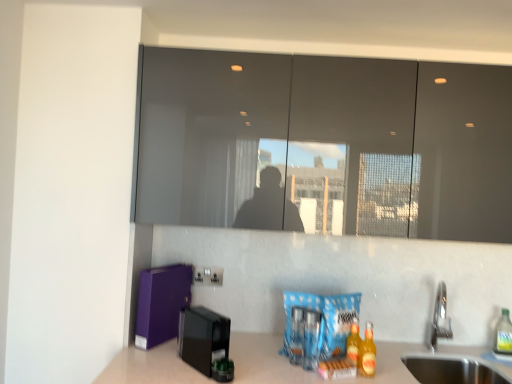
What do you see at coordinates (203, 337) in the screenshot?
I see `black plastic coffee machine at lower left` at bounding box center [203, 337].

This screenshot has width=512, height=384. In order to click on stainless steel sink at lower right, which ranks as the 2th sink in top-to-bottom order in this screenshot , I will do `click(452, 370)`.

Describe the element at coordinates (452, 370) in the screenshot. This screenshot has height=384, width=512. I see `silver metallic sink at lower right, the 1th sink from the top` at that location.

Identify the location of clear plastic bottle at lower right, the third beverage in the left-to-right sequence. (503, 335).

Looking at their sizes, would you say clear plastic bottle at lower right, placed as the 1th beverage when sorted from right to left, is wider or thinner than matte gray mirror at upper center?

Considering their sizes, clear plastic bottle at lower right, placed as the 1th beverage when sorted from right to left, looks slimmer than matte gray mirror at upper center.

Considering the sizes of objects clear plastic bottle at lower right, which is the third beverage from front to back, and matte gray mirror at upper center in the image provided, who is taller, clear plastic bottle at lower right, which is the third beverage from front to back, or matte gray mirror at upper center?

Standing taller between the two is matte gray mirror at upper center.

From a real-world perspective, is clear plastic bottle at lower right, which is counted as the first beverage, starting from the back, above or below matte gray mirror at upper center?

clear plastic bottle at lower right, which is counted as the first beverage, starting from the back, is situated lower than matte gray mirror at upper center in the real world.

Is clear plastic bottle at lower right, which is counted as the first beverage, starting from the back, facing towards matte gray mirror at upper center?

No, clear plastic bottle at lower right, which is counted as the first beverage, starting from the back, is not aimed at matte gray mirror at upper center.

What are the coordinates of `sink below the black plastic coffee machine at lower left (from a real-world perspective)` in the screenshot? It's located at (452, 370).

Is stainless steel sink at lower right, which is the first sink from bottom to top, at the right side of black plastic coffee machine at lower left?

Yes.

Does stainless steel sink at lower right, which is the first sink from bottom to top, have a greater height compared to black plastic coffee machine at lower left?

No, stainless steel sink at lower right, which is the first sink from bottom to top, is not taller than black plastic coffee machine at lower left.

Can you confirm if silver metallic sink at lower right, the 1th sink from the top, is wider than black plastic coffee machine at lower left?

In fact, silver metallic sink at lower right, the 1th sink from the top, might be narrower than black plastic coffee machine at lower left.

How many degrees apart are the facing directions of silver metallic sink at lower right, the 1th sink from the top, and black plastic coffee machine at lower left?

The angular difference between silver metallic sink at lower right, the 1th sink from the top, and black plastic coffee machine at lower left is 41.1 degrees.

Consider the image. Choose the correct answer: Is silver metallic sink at lower right, acting as the second sink starting from the bottom, inside black plastic coffee machine at lower left or outside it?

silver metallic sink at lower right, acting as the second sink starting from the bottom, cannot be found inside black plastic coffee machine at lower left.

Which of these two, translucent glass bottles at lower right, placed as the second beverage when sorted from right to left, or matte gray mirror at upper center, stands taller?

matte gray mirror at upper center.

This screenshot has width=512, height=384. What are the coordinates of `mirror positioned vertically above the translucent glass bottles at lower right, which is counted as the third beverage, starting from the back (from a real-world perspective)` in the screenshot? It's located at (325, 145).

Considering their positions, is translucent glass bottles at lower right, which is the second beverage from left to right, located in front of or behind matte gray mirror at upper center?

Clearly, translucent glass bottles at lower right, which is the second beverage from left to right, is in front of matte gray mirror at upper center.

Is translucent glass bottles at lower right, placed as the second beverage when sorted from right to left, positioned beyond the bounds of matte gray mirror at upper center?

Indeed, translucent glass bottles at lower right, placed as the second beverage when sorted from right to left, is completely outside matte gray mirror at upper center.

Is translucent glass bottles at lower right, which is the second beverage from left to right, inside translucent plastic bottle at center, the 3th beverage positioned from the right?

No, translucent glass bottles at lower right, which is the second beverage from left to right, is located outside of translucent plastic bottle at center, the 3th beverage positioned from the right.

From a real-world perspective, who is located higher, translucent plastic bottle at center, the 3th beverage positioned from the right, or translucent glass bottles at lower right, which is counted as the third beverage, starting from the back?

In real-world perspective, translucent glass bottles at lower right, which is counted as the third beverage, starting from the back, is above.

This screenshot has height=384, width=512. Identify the location of the 1st beverage behind the translucent glass bottles at lower right, which is counted as the third beverage, starting from the back, counting from the anchor's position. (353, 341).

In terms of width, does translucent plastic bottle at center, which is counted as the 2th beverage, starting from the front, look wider or thinner when compared to translucent glass bottles at lower right, which is the first beverage in front-to-back order?

translucent plastic bottle at center, which is counted as the 2th beverage, starting from the front, is thinner than translucent glass bottles at lower right, which is the first beverage in front-to-back order.

From a real-world perspective, is translucent plastic bottle at center, the 3th beverage positioned from the right, physically located above or below clear plastic bottle at lower right, which is counted as the first beverage, starting from the back?

translucent plastic bottle at center, the 3th beverage positioned from the right, is below clear plastic bottle at lower right, which is counted as the first beverage, starting from the back.

Which object is further away from the camera taking this photo, translucent plastic bottle at center, the first beverage when ordered from left to right, or clear plastic bottle at lower right, placed as the 1th beverage when sorted from right to left?

clear plastic bottle at lower right, placed as the 1th beverage when sorted from right to left, is further away from the camera.

Is point (356, 349) more distant than point (502, 314)?

No.

Can you confirm if translucent plastic bottle at center, which is counted as the 2th beverage, starting from the front, is taller than clear plastic bottle at lower right, placed as the 1th beverage when sorted from right to left?

No.

In terms of height, does silver metallic sink at lower right, acting as the second sink starting from the bottom, look taller or shorter compared to matte gray mirror at upper center?

silver metallic sink at lower right, acting as the second sink starting from the bottom, is shorter than matte gray mirror at upper center.

Considering the positions of points (437, 372) and (366, 72), is point (437, 372) farther from camera compared to point (366, 72)?

That is True.

From a real-world perspective, is silver metallic sink at lower right, acting as the second sink starting from the bottom, on top of matte gray mirror at upper center?

No.

Image resolution: width=512 pixels, height=384 pixels. Find the location of `the 3rd beverage below the matte gray mirror at upper center (from the image's perspective)`. the 3rd beverage below the matte gray mirror at upper center (from the image's perspective) is located at coordinates (503, 335).

Identify the location of appliance in front of the stainless steel sink at lower right, which ranks as the 2th sink in top-to-bottom order. The height and width of the screenshot is (384, 512). (203, 337).

When comparing their distances from black plastic coffee machine at lower left, does silver metallic sink at lower right, acting as the second sink starting from the bottom, or translucent glass bottles at lower right, which is the second beverage from left to right, seem closer?

Among the two, translucent glass bottles at lower right, which is the second beverage from left to right, is located nearer to black plastic coffee machine at lower left.

From the image, which object appears to be nearer to silver metallic sink at lower right, the 1th sink from the top, clear plastic bottle at lower right, the third beverage in the left-to-right sequence, or stainless steel sink at lower right, which ranks as the 2th sink in top-to-bottom order?

The object closer to silver metallic sink at lower right, the 1th sink from the top, is stainless steel sink at lower right, which ranks as the 2th sink in top-to-bottom order.

From the picture: Estimate the real-world distances between objects in this image. Which object is further from black plastic coffee machine at lower left, clear plastic bottle at lower right, which is counted as the first beverage, starting from the back, or silver metallic sink at lower right, acting as the second sink starting from the bottom?

The object further to black plastic coffee machine at lower left is silver metallic sink at lower right, acting as the second sink starting from the bottom.

From the image, which object appears to be nearer to translucent plastic bottle at center, which is counted as the 2th beverage, starting from the front, silver metallic sink at lower right, acting as the second sink starting from the bottom, or matte gray mirror at upper center?

The object closer to translucent plastic bottle at center, which is counted as the 2th beverage, starting from the front, is matte gray mirror at upper center.

From the image, which object appears to be nearer to silver metallic sink at lower right, acting as the second sink starting from the bottom, translucent glass bottles at lower right, which is the first beverage in front-to-back order, or clear plastic bottle at lower right, which is counted as the first beverage, starting from the back?

The object closer to silver metallic sink at lower right, acting as the second sink starting from the bottom, is clear plastic bottle at lower right, which is counted as the first beverage, starting from the back.

Looking at the image, which one is located closer to stainless steel sink at lower right, which is the first sink from bottom to top, translucent glass bottles at lower right, placed as the second beverage when sorted from right to left, or clear plastic bottle at lower right, placed as the 1th beverage when sorted from right to left?

clear plastic bottle at lower right, placed as the 1th beverage when sorted from right to left.

Which object lies further to the anchor point translucent plastic bottle at center, the 3th beverage positioned from the right, matte gray mirror at upper center or clear plastic bottle at lower right, which is counted as the first beverage, starting from the back?

matte gray mirror at upper center is further to translucent plastic bottle at center, the 3th beverage positioned from the right.

Considering their positions, is matte gray mirror at upper center positioned closer to translucent glass bottles at lower right, which is the second beverage from left to right, than silver metallic sink at lower right, the 1th sink from the top?

matte gray mirror at upper center is positioned closer to the anchor translucent glass bottles at lower right, which is the second beverage from left to right.

At what (x,y) coordinates should I click in order to perform the action: click on sink located between translucent plastic bottle at center, the first beverage when ordered from left to right, and silver metallic sink at lower right, acting as the second sink starting from the bottom, in the left-right direction. Please return your answer as a coordinate pair (x, y). The image size is (512, 384). Looking at the image, I should click on (452, 370).

In order to click on beverage between black plastic coffee machine at lower left and translucent glass bottles at lower right, which is the first beverage in front-to-back order, from left to right in this screenshot , I will do `click(353, 341)`.

Find the location of a particular element. This screenshot has width=512, height=384. mirror located between black plastic coffee machine at lower left and clear plastic bottle at lower right, the third beverage in the left-to-right sequence, in the left-right direction is located at coordinates (325, 145).

At what (x,y) coordinates should I click in order to perform the action: click on beverage located between translucent plastic bottle at center, which is counted as the second beverage, starting from the back, and silver metallic sink at lower right, acting as the second sink starting from the bottom, in the left-right direction. Please return your answer as a coordinate pair (x, y). Looking at the image, I should click on (367, 353).